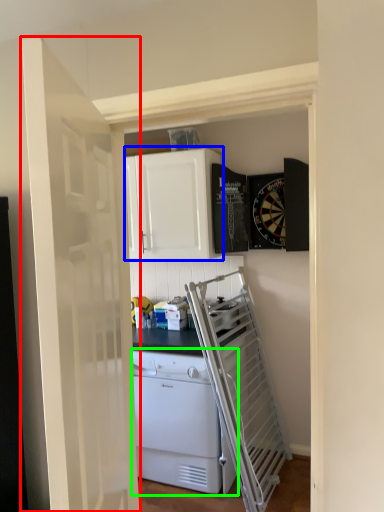
Question: Considering the real-world distances, which object is farthest from door (highlighted by a red box)? cabinetry (highlighted by a blue box) or home appliance (highlighted by a green box)?

Choices:
 (A) cabinetry
 (B) home appliance

Answer: (A)